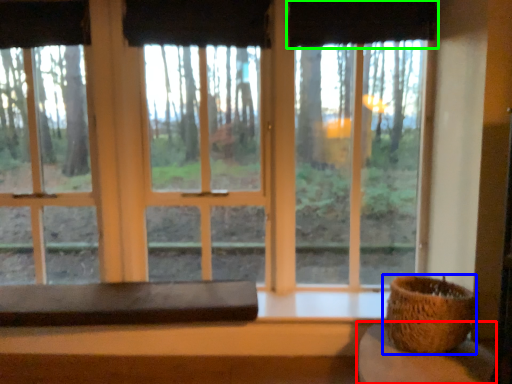
Question: Estimate the real-world distances between objects in this image. Which object is closer to table (highlighted by a red box), flowerpot (highlighted by a blue box) or curtain (highlighted by a green box)?

Choices:
 (A) flowerpot
 (B) curtain

Answer: (A)